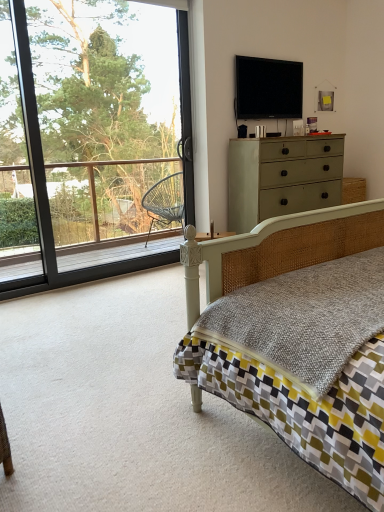
Question: Is flat screen tv at upper center taller than matte green dresser at upper right?

Choices:
 (A) yes
 (B) no

Answer: (B)

Question: Is flat screen tv at upper center positioned beyond the bounds of matte green dresser at upper right?

Choices:
 (A) yes
 (B) no

Answer: (A)

Question: Can you confirm if flat screen tv at upper center is positioned to the right of matte green dresser at upper right?

Choices:
 (A) no
 (B) yes

Answer: (A)

Question: Is flat screen tv at upper center directly adjacent to matte green dresser at upper right?

Choices:
 (A) no
 (B) yes

Answer: (A)

Question: Is flat screen tv at upper center aimed at matte green dresser at upper right?

Choices:
 (A) no
 (B) yes

Answer: (A)

Question: In the image, is transparent glass window at upper left positioned in front of or behind matte wicker bed at center?

Choices:
 (A) behind
 (B) front

Answer: (A)

Question: Is transparent glass window at upper left bigger or smaller than matte wicker bed at center?

Choices:
 (A) small
 (B) big

Answer: (A)

Question: Based on their positions, is transparent glass window at upper left located to the left or right of matte wicker bed at center?

Choices:
 (A) right
 (B) left

Answer: (B)

Question: Is point (8, 23) positioned closer to the camera than point (344, 210)?

Choices:
 (A) closer
 (B) farther

Answer: (B)

Question: Relative to transparent glass window at upper left, is matte green dresser at upper right in front or behind?

Choices:
 (A) behind
 (B) front

Answer: (A)

Question: Is point (278, 183) closer or farther from the camera than point (109, 131)?

Choices:
 (A) closer
 (B) farther

Answer: (A)

Question: Based on their positions, is matte green dresser at upper right located to the left or right of transparent glass window at upper left?

Choices:
 (A) left
 (B) right

Answer: (B)

Question: Is matte green dresser at upper right inside the boundaries of transparent glass window at upper left, or outside?

Choices:
 (A) inside
 (B) outside

Answer: (B)

Question: Relative to flat screen tv at upper center, is matte green dresser at upper right in front or behind?

Choices:
 (A) behind
 (B) front

Answer: (B)

Question: From a real-world perspective, is matte green dresser at upper right physically located above or below flat screen tv at upper center?

Choices:
 (A) above
 (B) below

Answer: (B)